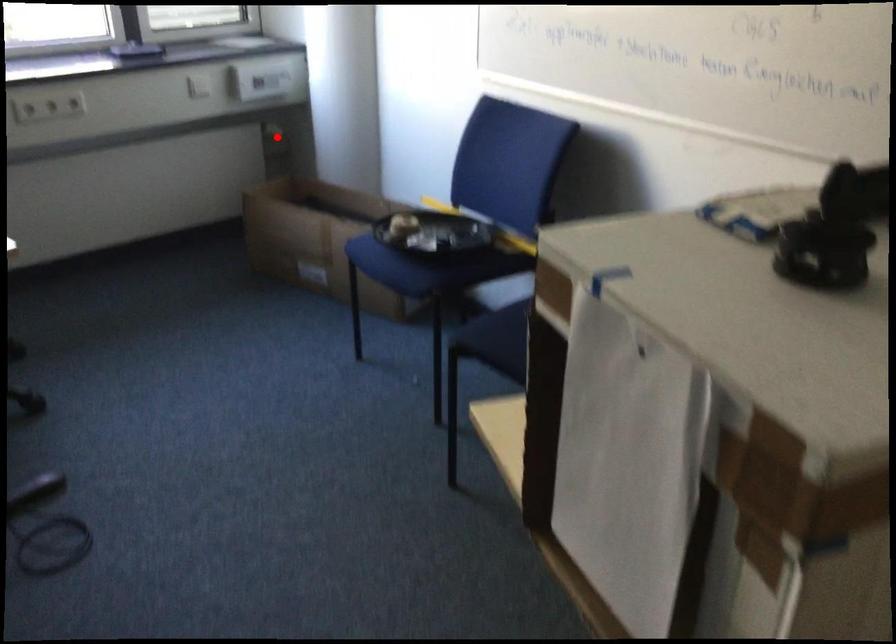
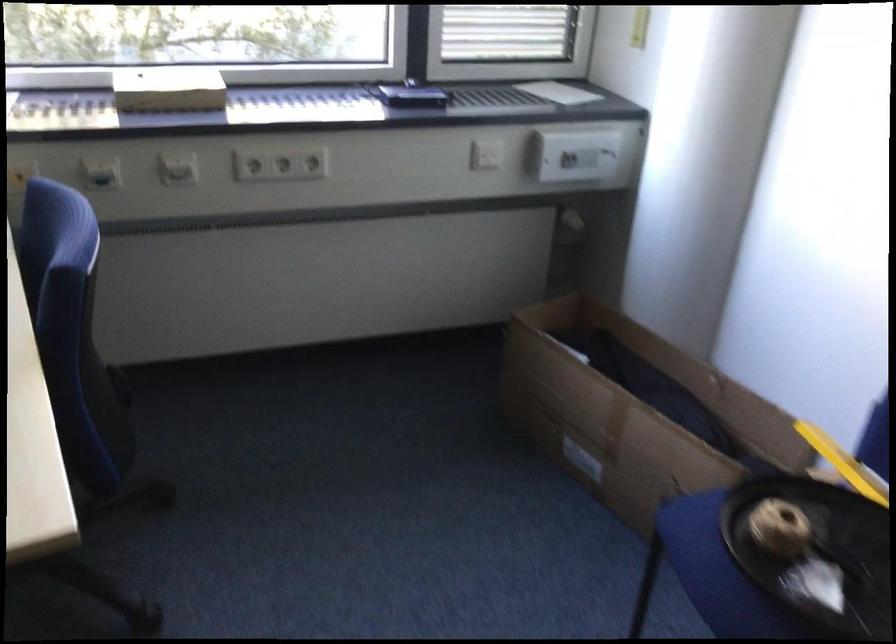
Question: I am providing you with two images of the same scene from different viewpoints. In image1, a red point is highlighted. Considering the same 3D point in image2, which of the following is correct?

Choices:
 (A) It is closer
 (B) It is farther

Answer: (A)